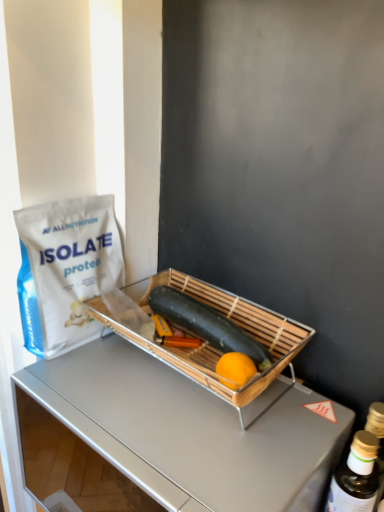
Question: From the image's perspective, is bamboo tray at center located beneath metallic silver desk at center?

Choices:
 (A) no
 (B) yes

Answer: (A)

Question: Considering the relative positions of bamboo tray at center and metallic silver desk at center in the image provided, is bamboo tray at center to the right of metallic silver desk at center from the viewer's perspective?

Choices:
 (A) yes
 (B) no

Answer: (A)

Question: Considering the relative sizes of bamboo tray at center and metallic silver desk at center in the image provided, is bamboo tray at center smaller than metallic silver desk at center?

Choices:
 (A) yes
 (B) no

Answer: (A)

Question: Can you confirm if bamboo tray at center is shorter than metallic silver desk at center?

Choices:
 (A) no
 (B) yes

Answer: (B)

Question: From the image's perspective, would you say bamboo tray at center is positioned over metallic silver desk at center?

Choices:
 (A) no
 (B) yes

Answer: (B)

Question: In terms of width, does smooth green zucchini at center look wider or thinner when compared to white matte protein powder bag at left?

Choices:
 (A) thin
 (B) wide

Answer: (A)

Question: In terms of height, does smooth green zucchini at center look taller or shorter compared to white matte protein powder bag at left?

Choices:
 (A) tall
 (B) short

Answer: (B)

Question: Considering their positions, is smooth green zucchini at center located in front of or behind white matte protein powder bag at left?

Choices:
 (A) front
 (B) behind

Answer: (B)

Question: Considering the positions of point (178, 325) and point (51, 247), is point (178, 325) closer or farther from the camera than point (51, 247)?

Choices:
 (A) closer
 (B) farther

Answer: (B)

Question: From the image's perspective, is smooth green zucchini at center above or below bamboo tray at center?

Choices:
 (A) above
 (B) below

Answer: (A)

Question: From their relative heights in the image, would you say smooth green zucchini at center is taller or shorter than bamboo tray at center?

Choices:
 (A) short
 (B) tall

Answer: (A)

Question: Looking at the image, does smooth green zucchini at center seem bigger or smaller compared to bamboo tray at center?

Choices:
 (A) small
 (B) big

Answer: (A)

Question: Visually, is smooth green zucchini at center positioned to the left or to the right of bamboo tray at center?

Choices:
 (A) left
 (B) right

Answer: (B)

Question: Which is correct: smooth green zucchini at center is inside gold metallic bottle at right, or outside of it?

Choices:
 (A) inside
 (B) outside

Answer: (B)

Question: Visually, is smooth green zucchini at center positioned to the left or to the right of gold metallic bottle at right?

Choices:
 (A) left
 (B) right

Answer: (A)